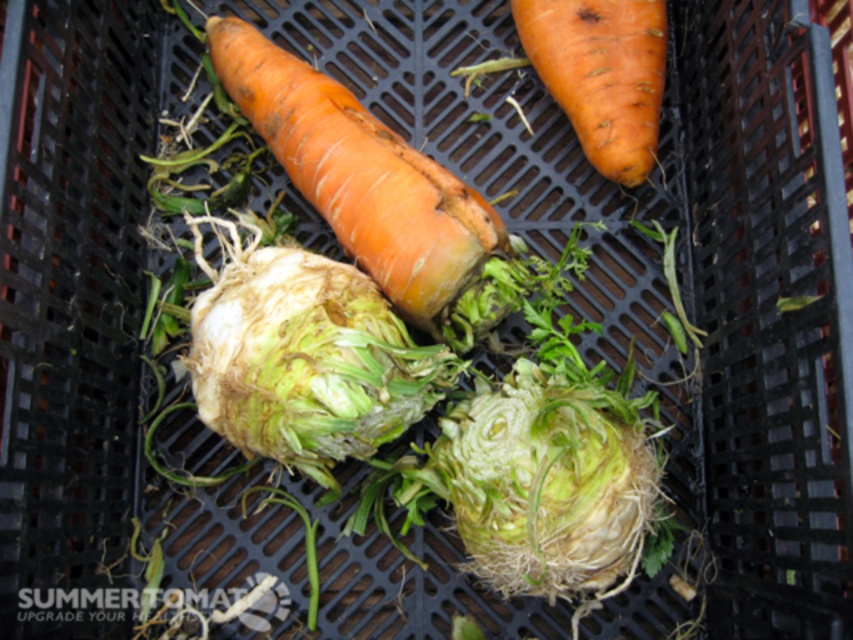
Can you confirm if green leafy celeriac at center is thinner than orange rough carrot at upper right?

No.

Which of these two, green leafy celeriac at center or orange rough carrot at upper right, stands shorter?

orange rough carrot at upper right

The image size is (853, 640). What are the coordinates of `green leafy celeriac at center` in the screenshot? It's located at (305, 356).

The height and width of the screenshot is (640, 853). What do you see at coordinates (370, 186) in the screenshot?
I see `orange rough carrot at center` at bounding box center [370, 186].

Can you confirm if orange rough carrot at center is positioned below orange rough carrot at upper right?

Yes, orange rough carrot at center is below orange rough carrot at upper right.

Describe the element at coordinates (370, 186) in the screenshot. I see `orange rough carrot at center` at that location.

You are a GUI agent. You are given a task and a screenshot of the screen. Output one action in this format:
    pyautogui.click(x=<x>, y=<y>)
    Task: Click on the orange rough carrot at center
    
    Given the screenshot: What is the action you would take?
    pyautogui.click(x=370, y=186)

Who is more distant from viewer, (519, 513) or (488, 300)?

The point (488, 300) is more distant.

This screenshot has height=640, width=853. In order to click on green fibrous cabbage at center in this screenshot , I will do `click(546, 483)`.

Looking at this image, who is more forward, (641, 432) or (364, 140)?

Point (641, 432) is in front.

You are a GUI agent. You are given a task and a screenshot of the screen. Output one action in this format:
    pyautogui.click(x=<x>, y=<y>)
    Task: Click on the green fibrous cabbage at center
    The image size is (853, 640).
    Given the screenshot: What is the action you would take?
    [546, 483]